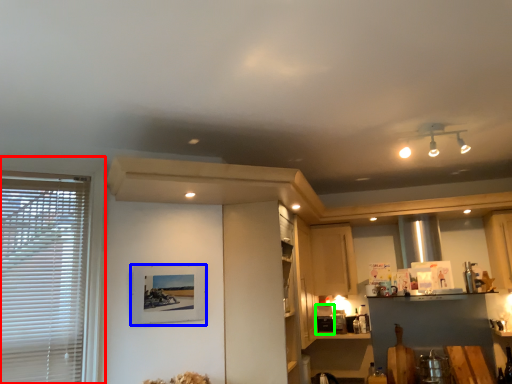
Question: Which is nearer to the window (highlighted by a red box)? picture frame (highlighted by a blue box) or appliance (highlighted by a green box).

Choices:
 (A) picture frame
 (B) appliance

Answer: (A)